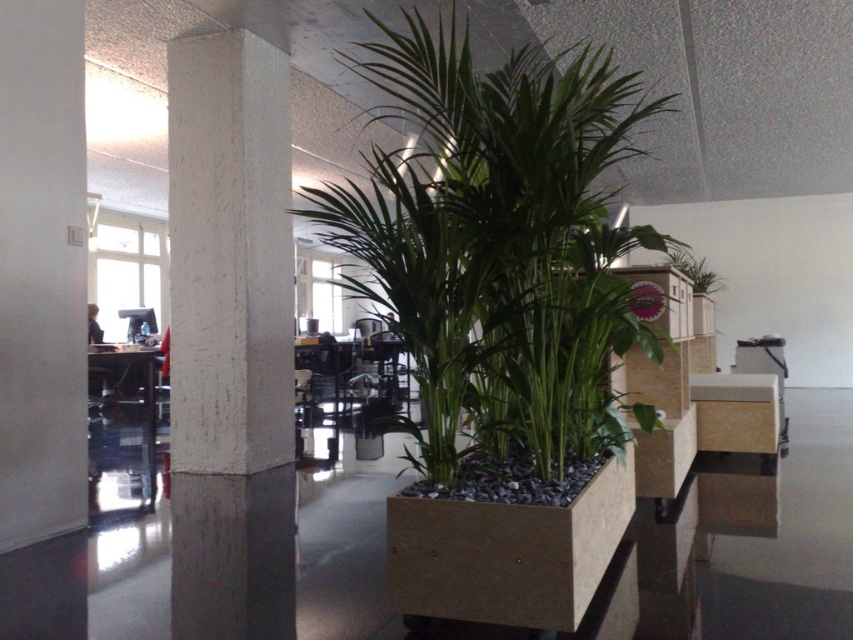
You are an office worker sitting at your desk and looking towards the white textured pillar at center and the green leafy plant at upper center. Which object is positioned to the left when viewed from your perspective?

The white textured pillar at center is positioned to the left of the green leafy plant at upper center from your perspective.

You are an office worker who needs to move a 5 meter long ladder from the entrance to the storage room. The path between the white textured pillar at center and the green leafy plant at upper center is the only route available. Will the ladder fit through this path?

The white textured pillar at center is 5.15 meters away from the green leafy plant at upper center. Since the ladder is 5 meters long, it will fit through the path between the white textured pillar at center and the green leafy plant at upper center as there is enough space.